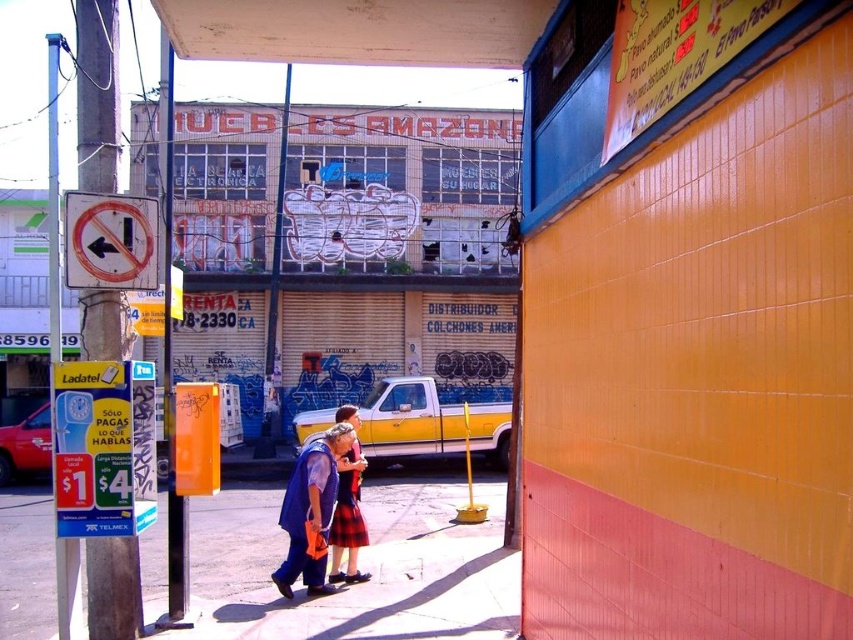
Which is above, smooth concrete sidewalk at center or orange plastic signpost at left?

Positioned higher is orange plastic signpost at left.

Can you confirm if smooth concrete sidewalk at center is positioned to the right of orange plastic signpost at left?

Correct, you'll find smooth concrete sidewalk at center to the right of orange plastic signpost at left.

Which is behind, point (276, 541) or point (83, 13)?

Positioned behind is point (276, 541).

Identify the location of smooth concrete sidewalk at center. (363, 564).

Does smooth concrete sidewalk at center have a greater width compared to plaid fabric skirt at center?

Yes.

Does smooth concrete sidewalk at center appear on the right side of plaid fabric skirt at center?

No, smooth concrete sidewalk at center is not to the right of plaid fabric skirt at center.

Which is in front, point (206, 577) or point (325, 493)?

Point (325, 493) is in front.

Identify the location of smooth concrete sidewalk at center. The width and height of the screenshot is (853, 640). (363, 564).

Is orange plastic signpost at left to the right of plaid fabric skirt at center from the viewer's perspective?

Incorrect, orange plastic signpost at left is not on the right side of plaid fabric skirt at center.

Is point (115, 612) more distant than point (296, 472)?

No, it is not.

Is point (88, 33) farther from camera compared to point (322, 512)?

That is False.

Locate an element on the screen. The image size is (853, 640). orange plastic signpost at left is located at coordinates (97, 93).